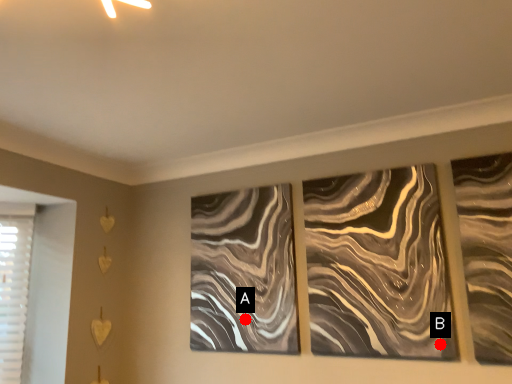
Question: Two points are circled on the image, labeled by A and B beside each circle. Among these points, which one is farthest from the camera?

Choices:
 (A) A is further
 (B) B is further

Answer: (A)